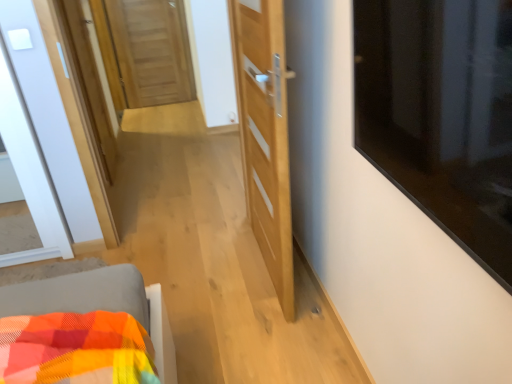
Locate an element on the screen. The width and height of the screenshot is (512, 384). vacant space in light wood door at center, which is the second door in top-to-bottom order (from a real-world perspective) is located at coordinates (263, 273).